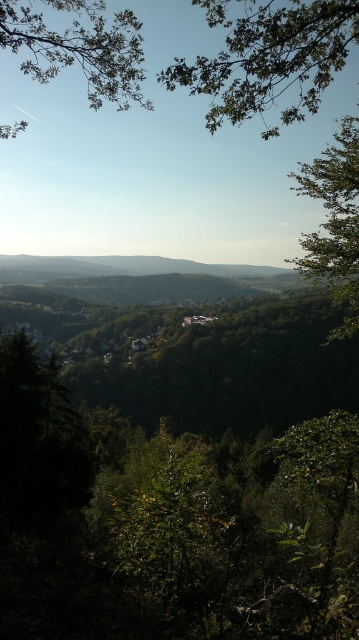
Between green leafy tree at right and green leafy hillside at center, which one appears on the left side from the viewer's perspective?

green leafy hillside at center

Between green leafy tree at right and green leafy hillside at center, which one is positioned higher?

green leafy hillside at center is above.

Does point (347, 189) lie behind point (196, 262)?

No, it is in front of (196, 262).

The height and width of the screenshot is (640, 359). I want to click on green leafy tree at right, so click(x=333, y=221).

Between point (198, 92) and point (333, 212), which one is positioned behind?

Point (333, 212)

At what (x,y) coordinates should I click in order to perform the action: click on green leafy branch at upper center. Please return your answer as a coordinate pair (x, y). This screenshot has width=359, height=640. Looking at the image, I should click on (268, 58).

Which is behind, point (305, 102) or point (142, 77)?

Positioned behind is point (305, 102).

Can you confirm if green leafy branch at upper center is smaller than green leafy tree at upper left?

Correct, green leafy branch at upper center occupies less space than green leafy tree at upper left.

What do you see at coordinates (268, 58) in the screenshot? I see `green leafy branch at upper center` at bounding box center [268, 58].

The height and width of the screenshot is (640, 359). Identify the location of green leafy branch at upper center. (268, 58).